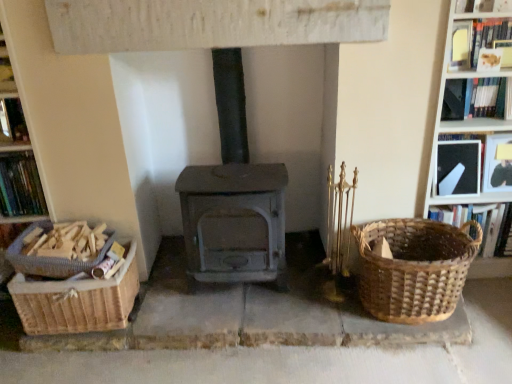
Image resolution: width=512 pixels, height=384 pixels. I want to click on vacant space to the right of woven brown basket at lower left, so click(170, 301).